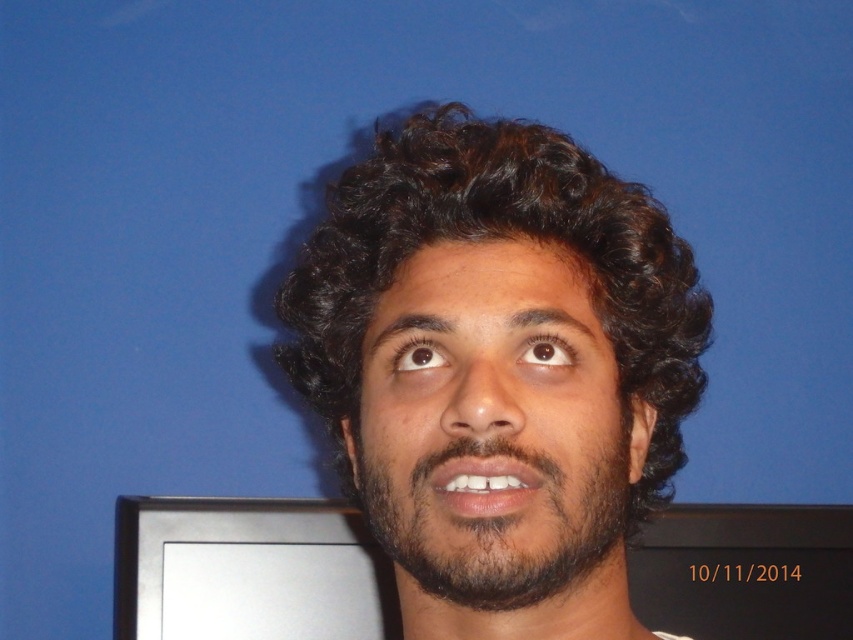
Question: Which object appears closest to the camera in this image?

Choices:
 (A) dark brown fuzzy beard at center
 (B) dark brown curly hair at center

Answer: (B)

Question: Can you confirm if dark brown curly hair at center is positioned above dark brown fuzzy beard at center?

Choices:
 (A) no
 (B) yes

Answer: (B)

Question: Which point is closer to the camera?

Choices:
 (A) dark brown curly hair at center
 (B) dark brown fuzzy beard at center

Answer: (A)

Question: Is dark brown curly hair at center smaller than dark brown fuzzy beard at center?

Choices:
 (A) yes
 (B) no

Answer: (B)

Question: Can you confirm if dark brown curly hair at center is positioned to the right of dark brown fuzzy beard at center?

Choices:
 (A) yes
 (B) no

Answer: (A)